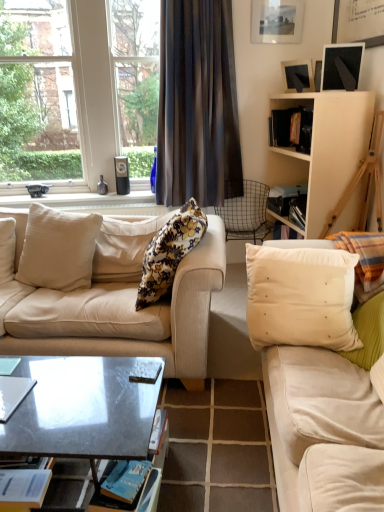
Question: From a real-world perspective, is blue paper magazine at lower left, marked as the 1th magazine in a bottom-to-top arrangement, located higher than white matte cabinet at upper right?

Choices:
 (A) no
 (B) yes

Answer: (A)

Question: Is blue paper magazine at lower left, marked as the 1th magazine in a bottom-to-top arrangement, facing towards white matte cabinet at upper right?

Choices:
 (A) no
 (B) yes

Answer: (A)

Question: Is blue paper magazine at lower left, placed as the second magazine when sorted from top to bottom, completely or partially outside of white matte cabinet at upper right?

Choices:
 (A) yes
 (B) no

Answer: (A)

Question: From the image's perspective, is blue paper magazine at lower left, placed as the second magazine when sorted from top to bottom, on white matte cabinet at upper right?

Choices:
 (A) yes
 (B) no

Answer: (B)

Question: Does blue paper magazine at lower left, placed as the second magazine when sorted from top to bottom, appear on the left side of white matte cabinet at upper right?

Choices:
 (A) yes
 (B) no

Answer: (A)

Question: Considering the relative positions of floral fabric pillow at center, acting as the third pillow starting from the right, and white fabric pillow at right, which is the 1th pillow from right to left, in the image provided, is floral fabric pillow at center, acting as the third pillow starting from the right, to the left or to the right of white fabric pillow at right, which is the 1th pillow from right to left,?

Choices:
 (A) right
 (B) left

Answer: (B)

Question: Which is correct: floral fabric pillow at center, acting as the third pillow starting from the right, is inside white fabric pillow at right, which is the 1th pillow from right to left, or outside of it?

Choices:
 (A) outside
 (B) inside

Answer: (A)

Question: Considering the positions of floral fabric pillow at center, which ranks as the 2th pillow in left-to-right order, and white fabric pillow at right, marked as the fourth pillow in a left-to-right arrangement, in the image, is floral fabric pillow at center, which ranks as the 2th pillow in left-to-right order, wider or thinner than white fabric pillow at right, marked as the fourth pillow in a left-to-right arrangement,?

Choices:
 (A) thin
 (B) wide

Answer: (A)

Question: Does point (150, 266) appear closer or farther from the camera than point (377, 258)?

Choices:
 (A) closer
 (B) farther

Answer: (A)

Question: From their relative heights in the image, would you say metallic gray coffee table at center is taller or shorter than beige fabric couch at left, which is the first studio couch in left-to-right order?

Choices:
 (A) short
 (B) tall

Answer: (A)

Question: From the image's perspective, relative to beige fabric couch at left, which is the first studio couch in left-to-right order, is metallic gray coffee table at center above or below?

Choices:
 (A) above
 (B) below

Answer: (B)

Question: Based on their sizes in the image, would you say metallic gray coffee table at center is bigger or smaller than beige fabric couch at left, which is the first studio couch in left-to-right order?

Choices:
 (A) small
 (B) big

Answer: (A)

Question: Is metallic gray coffee table at center wider or thinner than beige fabric couch at left, which is the first studio couch in left-to-right order?

Choices:
 (A) wide
 (B) thin

Answer: (B)

Question: From the image's perspective, is matte black picture frame at upper right located above or below white fabric pillow at right, which is the 1th pillow from right to left?

Choices:
 (A) above
 (B) below

Answer: (A)

Question: In the image, is matte black picture frame at upper right positioned in front of or behind white fabric pillow at right, marked as the fourth pillow in a left-to-right arrangement?

Choices:
 (A) behind
 (B) front

Answer: (A)